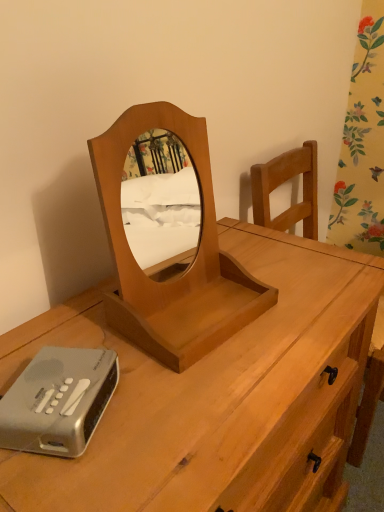
At what (x,y) coordinates should I click in order to perform the action: click on light brown wood desk at center. Please return your answer as a coordinate pair (x, y). The width and height of the screenshot is (384, 512). Looking at the image, I should click on (216, 395).

In the image, is light brown wood desk at center positioned in front of or behind light brown wood mirror at center?

Visually, light brown wood desk at center is located in front of light brown wood mirror at center.

Considering the positions of points (311, 428) and (151, 326), is point (311, 428) farther from camera compared to point (151, 326)?

Yes, point (311, 428) is farther from viewer.

Which of these two, light brown wood desk at center or light brown wood mirror at center, is bigger?

Bigger between the two is light brown wood desk at center.

From the image's perspective, relative to light brown wood desk at center, is light brown wood mirror at center above or below?

From the image's perspective, light brown wood mirror at center appears above light brown wood desk at center.

Is the position of light brown wood mirror at center less distant than that of light brown wood desk at center?

No, it is behind light brown wood desk at center.

In the scene shown: Is light brown wood mirror at center oriented away from light brown wood desk at center?

No, light brown wood mirror at center is not facing away from light brown wood desk at center.

Locate an element on the screen. This screenshot has height=512, width=384. mirror above the silver plastic alarm clock at lower left (from the image's perspective) is located at coordinates (176, 265).

From a real-world perspective, is light brown wood mirror at center over silver plastic alarm clock at lower left?

Correct, in the physical world, light brown wood mirror at center is higher than silver plastic alarm clock at lower left.

Is light brown wood mirror at center taller than silver plastic alarm clock at lower left?

Correct, light brown wood mirror at center is much taller as silver plastic alarm clock at lower left.

From the picture: Does light brown wood mirror at center come behind silver plastic alarm clock at lower left?

No, light brown wood mirror at center is closer to the viewer.

From a real-world perspective, is silver plastic alarm clock at lower left positioned above or below light brown wood mirror at center?

From a real-world perspective, silver plastic alarm clock at lower left is physically below light brown wood mirror at center.

Considering the positions of objects silver plastic alarm clock at lower left and light brown wood mirror at center in the image provided, who is more to the right, silver plastic alarm clock at lower left or light brown wood mirror at center?

light brown wood mirror at center is more to the right.

From the picture: Is silver plastic alarm clock at lower left not close to light brown wood mirror at center?

That's not correct — silver plastic alarm clock at lower left is a little close to light brown wood mirror at center.

Considering the relative sizes of silver plastic alarm clock at lower left and light brown wood mirror at center in the image provided, is silver plastic alarm clock at lower left wider than light brown wood mirror at center?

Incorrect, the width of silver plastic alarm clock at lower left does not surpass that of light brown wood mirror at center.

Is silver plastic alarm clock at lower left looking in the opposite direction of light brown wood desk at center?

Absolutely, silver plastic alarm clock at lower left is directed away from light brown wood desk at center.

From a real-world perspective, is silver plastic alarm clock at lower left located higher than light brown wood desk at center?

Indeed, from a real-world perspective, silver plastic alarm clock at lower left stands above light brown wood desk at center.

Can you tell me how much silver plastic alarm clock at lower left and light brown wood desk at center differ in facing direction?

There is a 27.2-degree angle between the facing directions of silver plastic alarm clock at lower left and light brown wood desk at center.

Does silver plastic alarm clock at lower left touch light brown wood desk at center?

No, silver plastic alarm clock at lower left is not making contact with light brown wood desk at center.

Does light brown wood desk at center have a larger size compared to silver plastic alarm clock at lower left?

Indeed, light brown wood desk at center has a larger size compared to silver plastic alarm clock at lower left.

Considering the relative positions of light brown wood desk at center and silver plastic alarm clock at lower left in the image provided, is light brown wood desk at center in front of silver plastic alarm clock at lower left?

Yes, light brown wood desk at center is closer to the viewer.

From the image's perspective, is light brown wood desk at center beneath silver plastic alarm clock at lower left?

Yes.

Considering the sizes of light brown wood desk at center and silver plastic alarm clock at lower left in the image, is light brown wood desk at center taller or shorter than silver plastic alarm clock at lower left?

Clearly, light brown wood desk at center is taller compared to silver plastic alarm clock at lower left.

There is a light brown wood desk at center. Where is `mirror above it (from a real-world perspective)`? This screenshot has width=384, height=512. mirror above it (from a real-world perspective) is located at coordinates (176, 265).

Locate an element on the screen. mirror on the left of light brown wood desk at center is located at coordinates (176, 265).

Based on their spatial positions, is light brown wood desk at center or light brown wood mirror at center closer to silver plastic alarm clock at lower left?

Based on the image, light brown wood mirror at center appears to be nearer to silver plastic alarm clock at lower left.

Based on their spatial positions, is silver plastic alarm clock at lower left or light brown wood desk at center further from light brown wood mirror at center?

silver plastic alarm clock at lower left is further to light brown wood mirror at center.

Looking at the image, which one is located further to light brown wood mirror at center, light brown wood desk at center or silver plastic alarm clock at lower left?

silver plastic alarm clock at lower left.

Based on their spatial positions, is light brown wood mirror at center or light brown wood desk at center further from silver plastic alarm clock at lower left?

light brown wood desk at center lies further to silver plastic alarm clock at lower left than the other object.

When comparing their distances from light brown wood desk at center, does silver plastic alarm clock at lower left or light brown wood mirror at center seem further?

silver plastic alarm clock at lower left.

When comparing their distances from light brown wood desk at center, does light brown wood mirror at center or silver plastic alarm clock at lower left seem closer?

Based on the image, light brown wood mirror at center appears to be nearer to light brown wood desk at center.

Where is `gadget between light brown wood mirror at center and light brown wood desk at center vertically`? The image size is (384, 512). gadget between light brown wood mirror at center and light brown wood desk at center vertically is located at coordinates (58, 401).